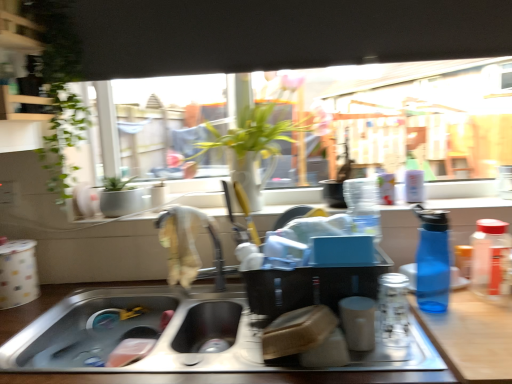
In order to click on vacant space in front of transparent glass jar at right, which appears as the 3th bottle when viewed from the left in this screenshot , I will do `click(493, 322)`.